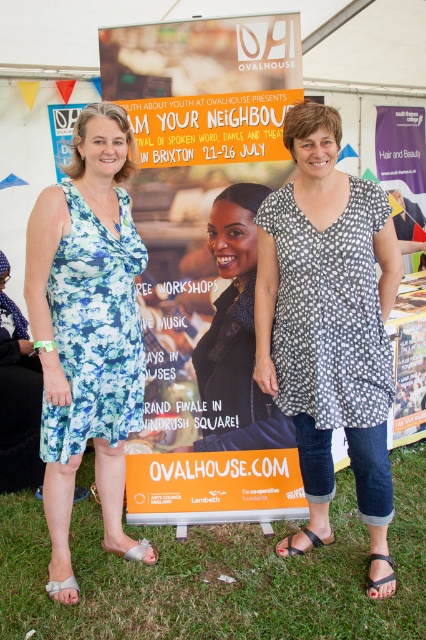
Question: Does floral fabric dress at left appear on the right side of white fabric sandal at lower left?

Choices:
 (A) no
 (B) yes

Answer: (B)

Question: Is black dotted dress at center to the left of black fabric sandal at lower center from the viewer's perspective?

Choices:
 (A) no
 (B) yes

Answer: (A)

Question: Estimate the real-world distances between objects in this image. Which object is closer to the brown leather sandal at lower right?

Choices:
 (A) green grass at lower center
 (B) floral fabric dress at left
 (C) blue floral dress at left

Answer: (A)

Question: Among these objects, which one is farthest from the camera?

Choices:
 (A) blue floral dress at left
 (B) white fabric sandal at lower left
 (C) green grass at lower center

Answer: (B)

Question: Where is blue floral dress at left located in relation to white fabric sandal at lower left in the image?

Choices:
 (A) below
 (B) above

Answer: (B)

Question: Which of the following is the farthest from the observer?

Choices:
 (A) (115, 429)
 (B) (135, 561)

Answer: (B)